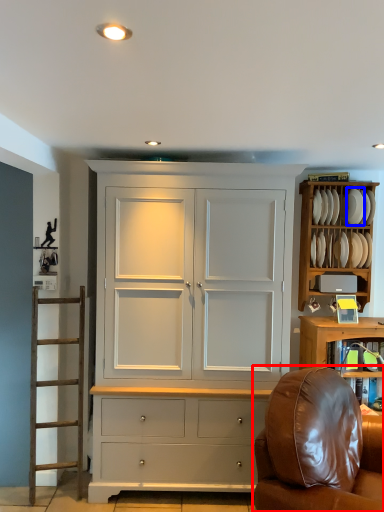
Question: Among these objects, which one is farthest to the camera, chair (highlighted by a red box) or plate (highlighted by a blue box)?

Choices:
 (A) chair
 (B) plate

Answer: (B)